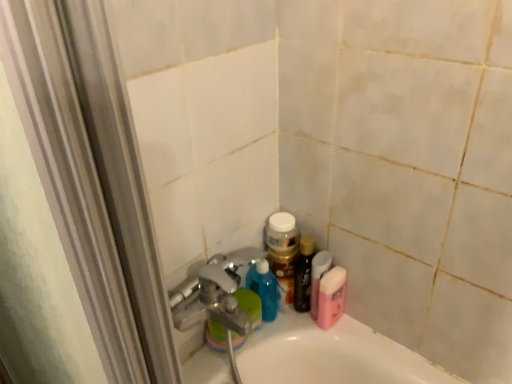
Question: Is pink matte bottle at lower right, which is the second mouthwash from left to right, completely or partially inside shiny brown bottle at lower right?

Choices:
 (A) no
 (B) yes

Answer: (A)

Question: Does shiny brown bottle at lower right have a greater height compared to pink matte bottle at lower right, which ranks as the 1th mouthwash in right-to-left order?

Choices:
 (A) yes
 (B) no

Answer: (A)

Question: Would you say shiny brown bottle at lower right is outside pink matte bottle at lower right, which ranks as the 1th mouthwash in right-to-left order?

Choices:
 (A) yes
 (B) no

Answer: (A)

Question: Is shiny brown bottle at lower right at the right side of pink matte bottle at lower right, which ranks as the 1th mouthwash in right-to-left order?

Choices:
 (A) yes
 (B) no

Answer: (B)

Question: Are shiny brown bottle at lower right and pink matte bottle at lower right, which ranks as the 1th mouthwash in right-to-left order, located far from each other?

Choices:
 (A) yes
 (B) no

Answer: (B)

Question: Is shiny brown bottle at lower right aimed at pink matte bottle at lower right, which ranks as the 1th mouthwash in right-to-left order?

Choices:
 (A) no
 (B) yes

Answer: (A)

Question: Are pink matte bottle at lower right, which ranks as the 1th mouthwash in right-to-left order, and shiny brown bottle at lower right making contact?

Choices:
 (A) no
 (B) yes

Answer: (B)

Question: Is pink matte bottle at lower right, which ranks as the 1th mouthwash in right-to-left order, at the left side of shiny brown bottle at lower right?

Choices:
 (A) yes
 (B) no

Answer: (B)

Question: Is pink matte bottle at lower right, which is the second mouthwash from left to right, smaller than shiny brown bottle at lower right?

Choices:
 (A) no
 (B) yes

Answer: (A)

Question: Is pink matte bottle at lower right, which ranks as the 1th mouthwash in right-to-left order, positioned beyond the bounds of shiny brown bottle at lower right?

Choices:
 (A) yes
 (B) no

Answer: (A)

Question: Does pink matte bottle at lower right, which is the second mouthwash from left to right, come behind shiny brown bottle at lower right?

Choices:
 (A) yes
 (B) no

Answer: (B)

Question: Considering the relative sizes of pink matte bottle at lower right, which ranks as the 1th mouthwash in right-to-left order, and shiny brown bottle at lower right in the image provided, is pink matte bottle at lower right, which ranks as the 1th mouthwash in right-to-left order, bigger than shiny brown bottle at lower right?

Choices:
 (A) no
 (B) yes

Answer: (B)

Question: Is pink matte bottle at lower right, which ranks as the 1th mouthwash in right-to-left order, oriented towards pink glossy bottle at upper right, which is the first mouthwash in left-to-right order?

Choices:
 (A) yes
 (B) no

Answer: (B)